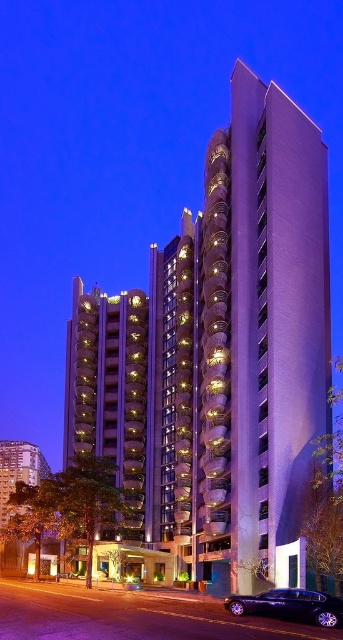
Question: Does purple smooth building at center appear on the right side of shiny black sedan at lower right?

Choices:
 (A) no
 (B) yes

Answer: (B)

Question: Observing the image, what is the correct spatial positioning of purple smooth building at center in reference to shiny black sedan at lower right?

Choices:
 (A) below
 (B) above

Answer: (B)

Question: Is purple smooth building at center bigger than shiny black sedan at lower right?

Choices:
 (A) no
 (B) yes

Answer: (B)

Question: Which point is closer to the camera taking this photo?

Choices:
 (A) (253, 604)
 (B) (249, 92)

Answer: (A)